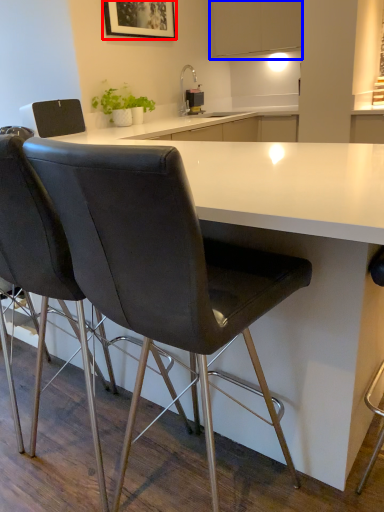
Question: Which object is closer to the camera taking this photo, picture frame (highlighted by a red box) or cabinetry (highlighted by a blue box)?

Choices:
 (A) picture frame
 (B) cabinetry

Answer: (A)